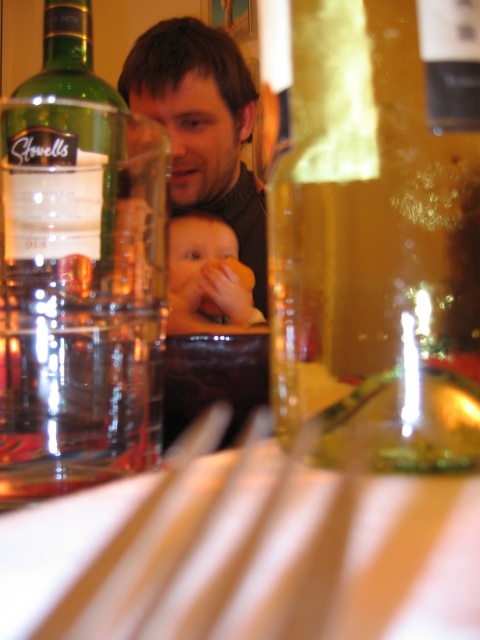
Is point (15, 259) farther from viewer compared to point (193, 237)?

No, it is not.

Which is behind, point (93, 280) or point (186, 227)?

The point (186, 227) is more distant.

Where is `green glass bottle at upper left`? The height and width of the screenshot is (640, 480). green glass bottle at upper left is located at coordinates (78, 273).

Can you confirm if matte black sweater at center is wider than smooth skin baby at center?

Correct, the width of matte black sweater at center exceeds that of smooth skin baby at center.

Between point (232, 204) and point (197, 269), which one is positioned in front?

Point (197, 269)

In order to click on matte black sweater at center in this screenshot , I will do `click(203, 125)`.

Does translucent glass bottle at center come in front of smooth skin baby at center?

Yes, it is in front of smooth skin baby at center.

This screenshot has height=640, width=480. Identify the location of translucent glass bottle at center. (374, 227).

The height and width of the screenshot is (640, 480). I want to click on translucent glass bottle at center, so [x=374, y=227].